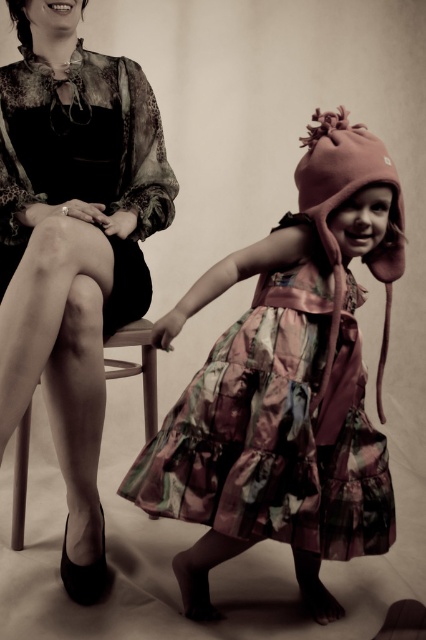
Which is below, shiny floral dress at center or wooden chair at left?

Positioned lower is wooden chair at left.

Who is positioned more to the left, shiny floral dress at center or wooden chair at left?

Positioned to the left is wooden chair at left.

The image size is (426, 640). I want to click on shiny floral dress at center, so click(x=276, y=428).

Which is below, matte black dress at left or silky floral dress at left?

matte black dress at left

Does matte black dress at left appear on the right side of silky floral dress at left?

In fact, matte black dress at left is to the left of silky floral dress at left.

Measure the distance between point (95, 112) and camera.

Result: Point (95, 112) and camera are 5.28 feet apart from each other.

The width and height of the screenshot is (426, 640). Identify the location of matte black dress at left. (72, 244).

Is matte black dress at left to the left of wooden chair at left from the viewer's perspective?

Indeed, matte black dress at left is positioned on the left side of wooden chair at left.

Who is shorter, matte black dress at left or wooden chair at left?

Standing shorter between the two is wooden chair at left.

You are a GUI agent. You are given a task and a screenshot of the screen. Output one action in this format:
    pyautogui.click(x=<x>, y=<y>)
    Task: Click on the matte black dress at left
    This screenshot has height=640, width=426.
    Given the screenshot: What is the action you would take?
    click(x=72, y=244)